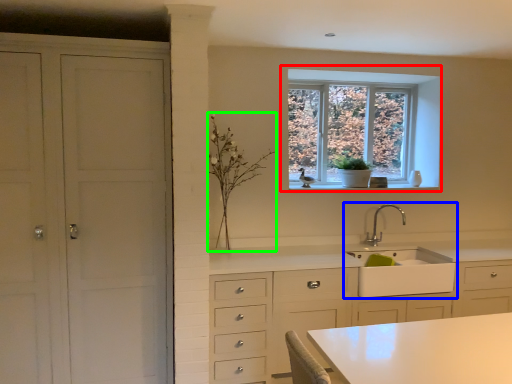
Question: Based on their relative distances, which object is farther from window (highlighted by a red box)? Choose from sink (highlighted by a blue box) and plant (highlighted by a green box).

Choices:
 (A) sink
 (B) plant

Answer: (B)